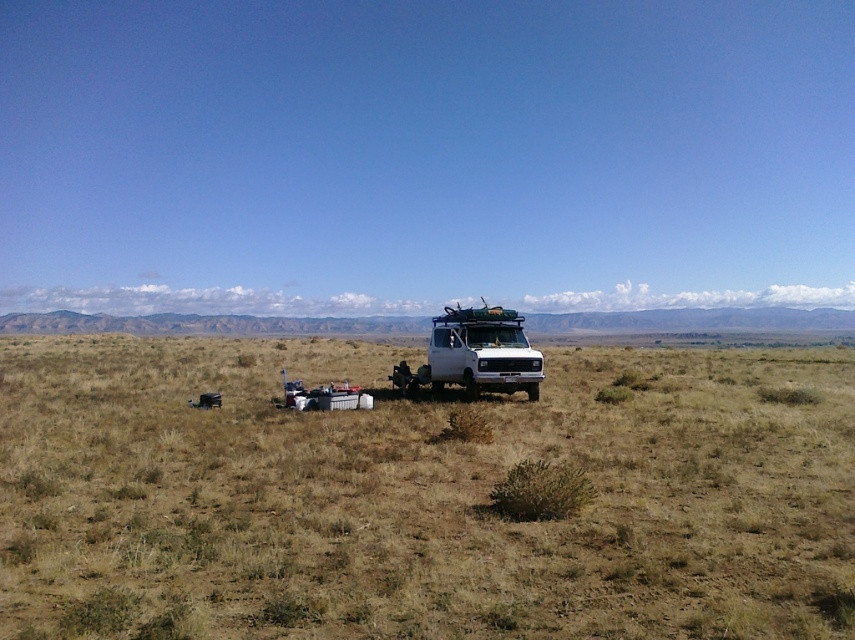
Question: Which point appears closest to the camera in this image?

Choices:
 (A) (438, 369)
 (B) (128, 403)

Answer: (B)

Question: Is brown dry grass at center below white matte van at center?

Choices:
 (A) no
 (B) yes

Answer: (B)

Question: Does brown dry grass at center lie in front of white matte van at center?

Choices:
 (A) yes
 (B) no

Answer: (A)

Question: Does brown dry grass at center have a larger size compared to white matte van at center?

Choices:
 (A) yes
 (B) no

Answer: (A)